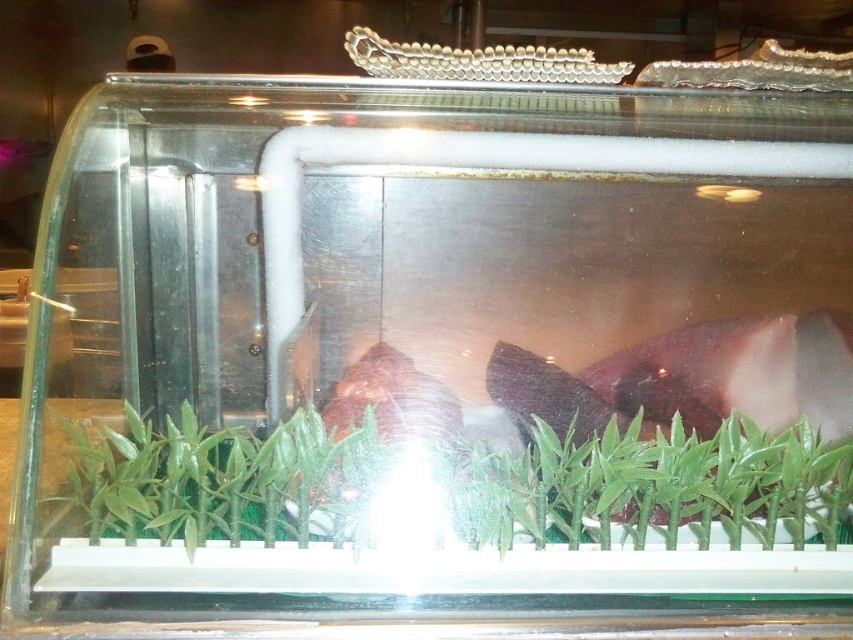
Question: Which object is closer to the camera taking this photo?

Choices:
 (A) green matte bamboo at lower center
 (B) green matte plant at center

Answer: (B)

Question: Where is green matte bamboo at lower center located in relation to green matte plant at center in the image?

Choices:
 (A) below
 (B) above

Answer: (B)

Question: Does green matte bamboo at lower center come behind green matte plant at center?

Choices:
 (A) no
 (B) yes

Answer: (B)

Question: Considering the relative positions of green matte bamboo at lower center and green matte plant at center in the image provided, where is green matte bamboo at lower center located with respect to green matte plant at center?

Choices:
 (A) right
 (B) left

Answer: (A)